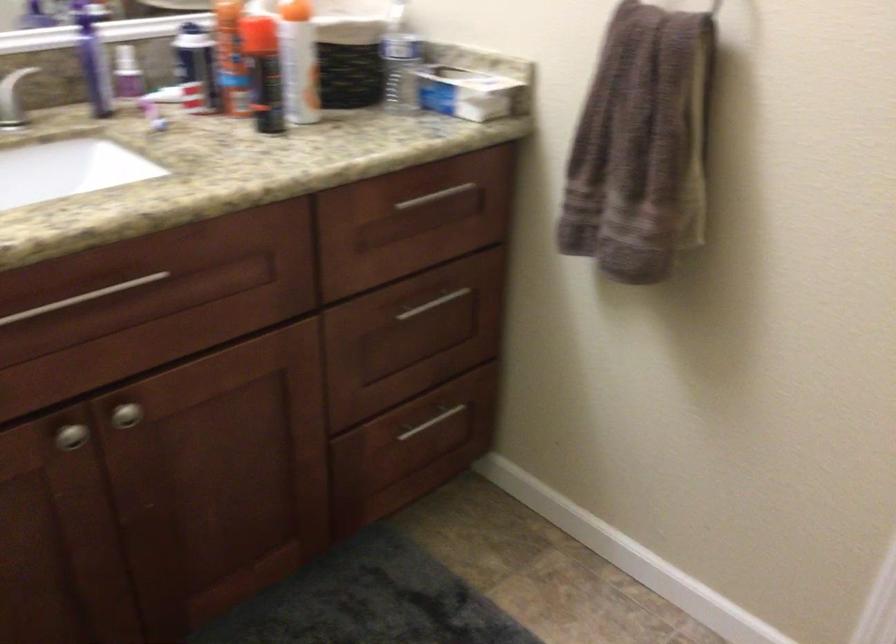
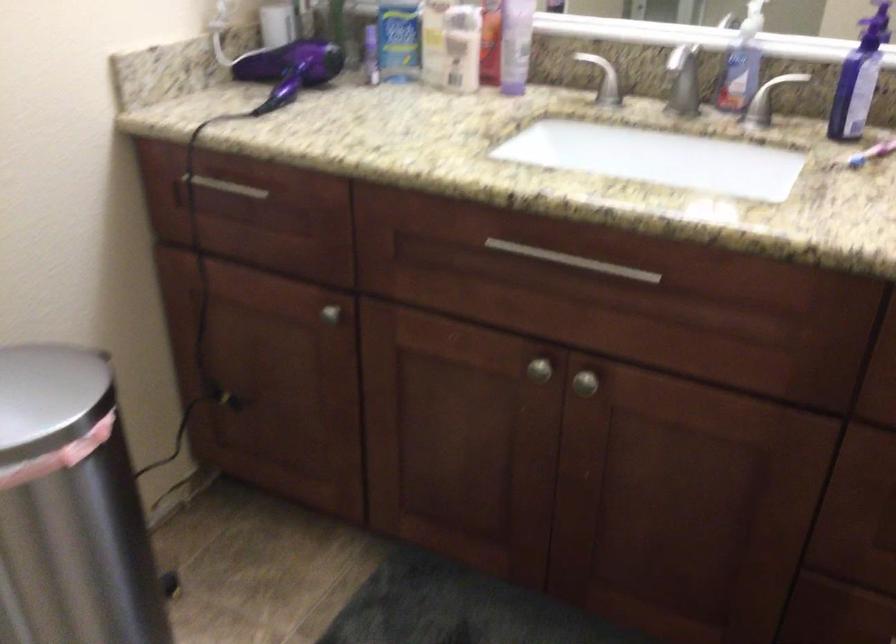
Based on the continuous images, in which direction is the camera rotating?

The camera's rotation is toward left-down.